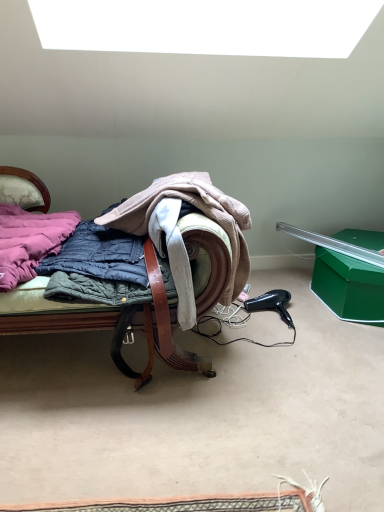
Where is `unoccupied area in front of black plastic hair dryer at lower right`? unoccupied area in front of black plastic hair dryer at lower right is located at coordinates (294, 340).